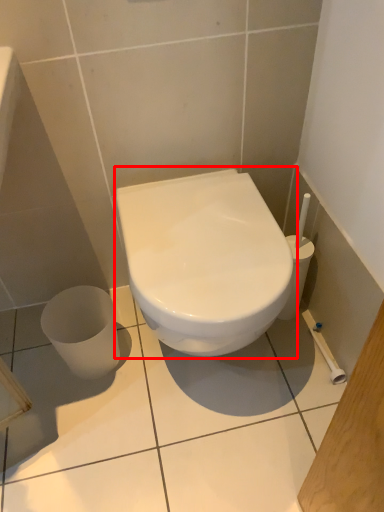
Question: From the image's perspective, where is toilet (annotated by the red box) located in relation to ceramic tile in the image?

Choices:
 (A) above
 (B) below

Answer: (A)